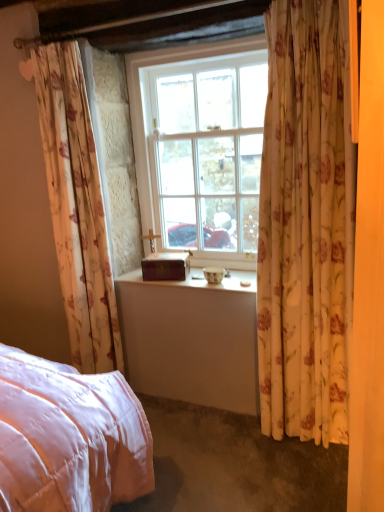
You are a GUI agent. You are given a task and a screenshot of the screen. Output one action in this format:
    pyautogui.click(x=<x>, y=<y>)
    Task: Click on the vacant space in floral fabric curtain at right, the 1th curtain from the right (from a real-world perspective)
    The width and height of the screenshot is (384, 512).
    Given the screenshot: What is the action you would take?
    (301, 439)